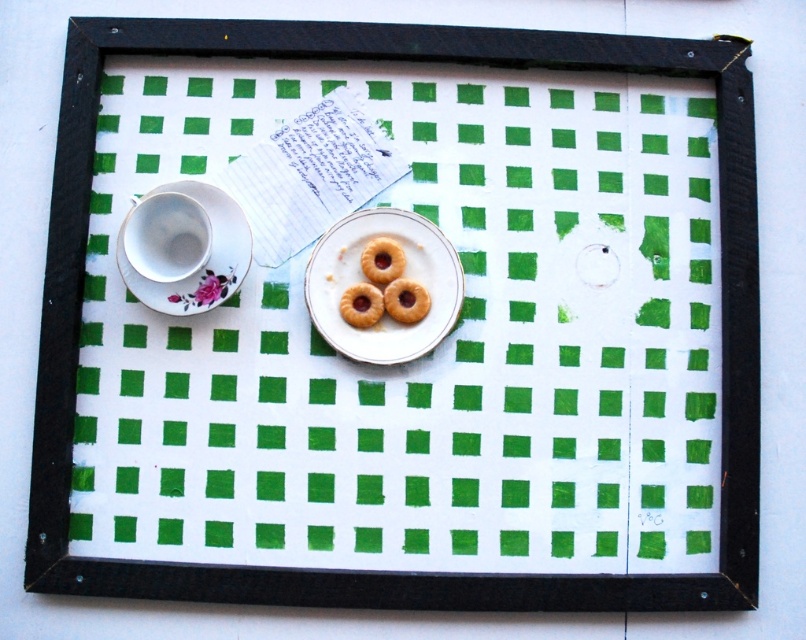
Does white porcelain saucer at center appear over matte brown cookie at center?

Yes, white porcelain saucer at center is above matte brown cookie at center.

Is the position of white porcelain saucer at center less distant than that of matte brown cookie at center?

Yes, white porcelain saucer at center is in front of matte brown cookie at center.

Image resolution: width=806 pixels, height=640 pixels. Describe the element at coordinates (358, 276) in the screenshot. I see `white porcelain saucer at center` at that location.

Where is `white porcelain saucer at center`? This screenshot has height=640, width=806. white porcelain saucer at center is located at coordinates (358, 276).

Does white porcelain saucer at center have a smaller size compared to golden crispy cookie at center?

Actually, white porcelain saucer at center might be larger than golden crispy cookie at center.

Between white porcelain saucer at center and golden crispy cookie at center, which one has less height?

Standing shorter between the two is golden crispy cookie at center.

You are a GUI agent. You are given a task and a screenshot of the screen. Output one action in this format:
    pyautogui.click(x=<x>, y=<y>)
    Task: Click on the white porcelain saucer at center
    The image size is (806, 640).
    Given the screenshot: What is the action you would take?
    pyautogui.click(x=358, y=276)

In the scene shown: Is white porcelain saucer at center thinner than golden matte donut at center?

No, white porcelain saucer at center is not thinner than golden matte donut at center.

How distant is white porcelain saucer at center from golden matte donut at center?

white porcelain saucer at center is 2.24 centimeters away from golden matte donut at center.

Does point (327, 248) lie behind point (414, 298)?

Yes.

Where is `white porcelain saucer at center`? This screenshot has width=806, height=640. white porcelain saucer at center is located at coordinates click(358, 276).